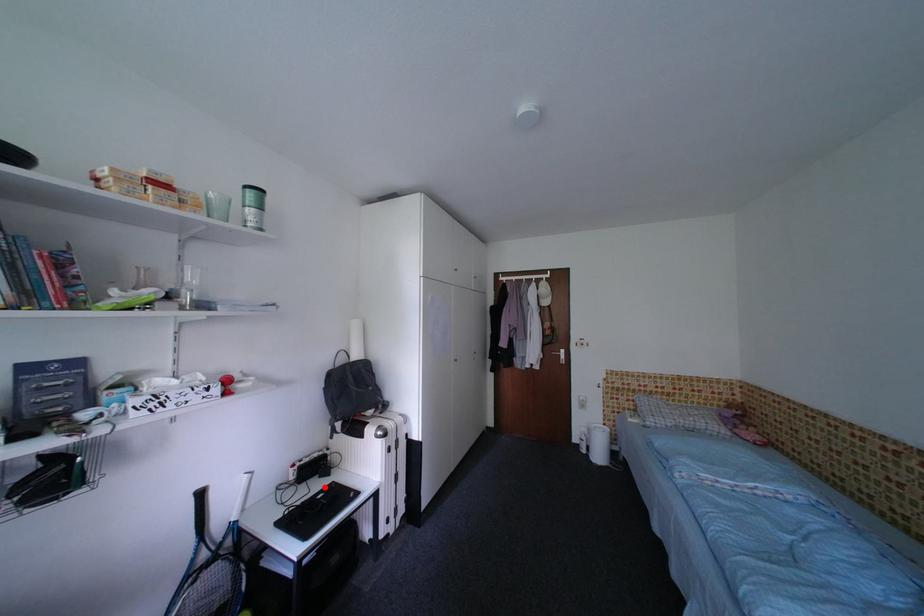
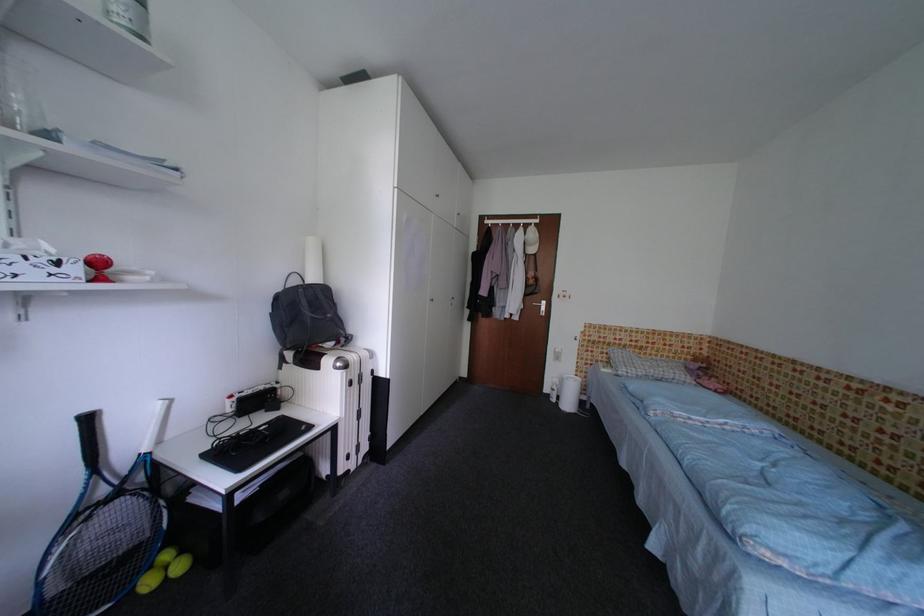
Question: I am providing you with two images of the same scene from different viewpoints. Image1 has a red point marked. In image2, the corresponding 3D location appears at what relative position? Reply with the corresponding letter.

Choices:
 (A) Closer
 (B) Farther

Answer: (A)